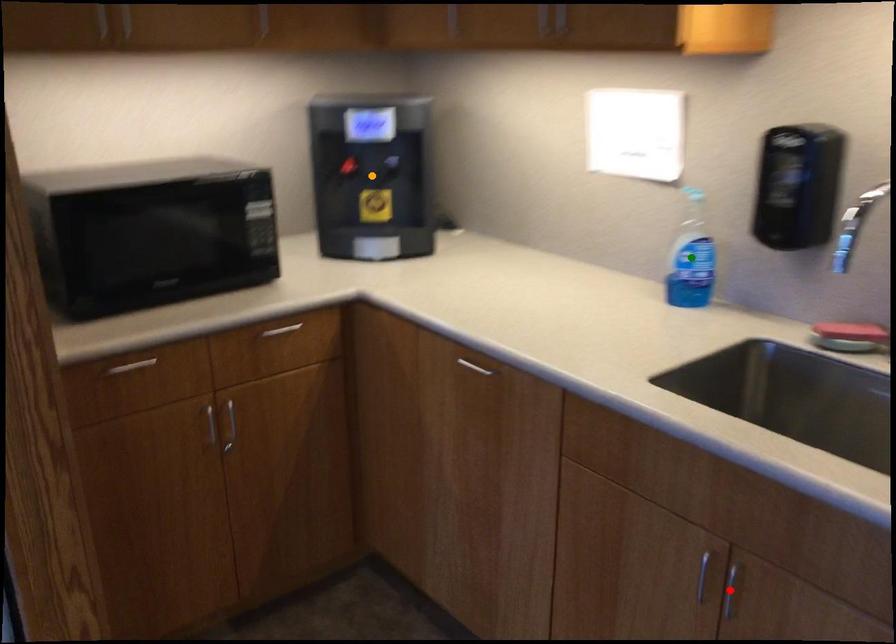
Order these from nearest to farthest:
- red point
- orange point
- green point

red point < green point < orange point